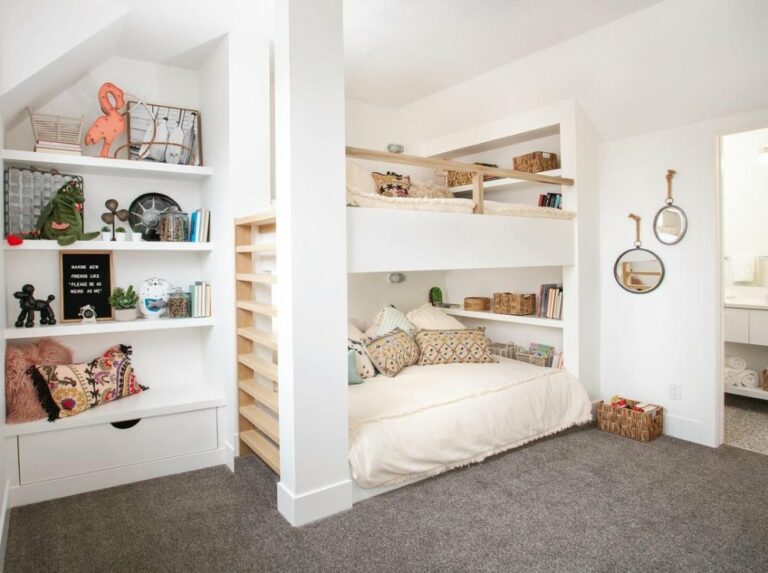
Where is `brown frame on picture`? This screenshot has height=573, width=768. brown frame on picture is located at coordinates (113, 277).